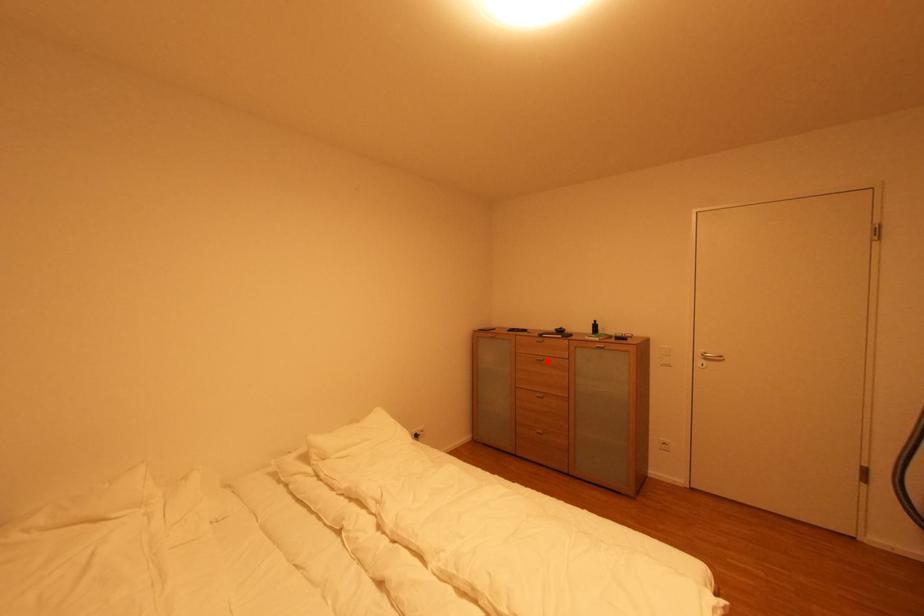
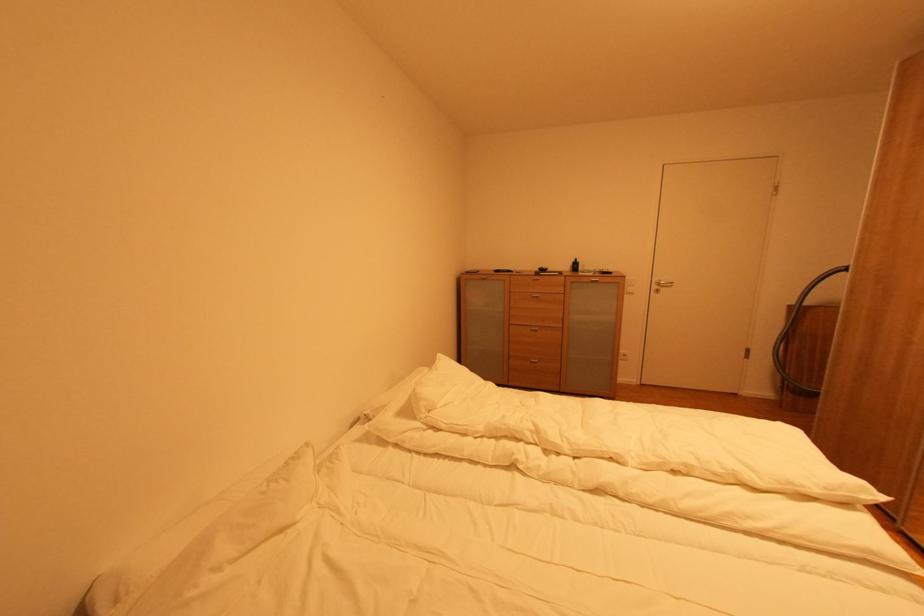
In the second image, find the point that corresponds to the highlighted location in the first image.

(542, 298)